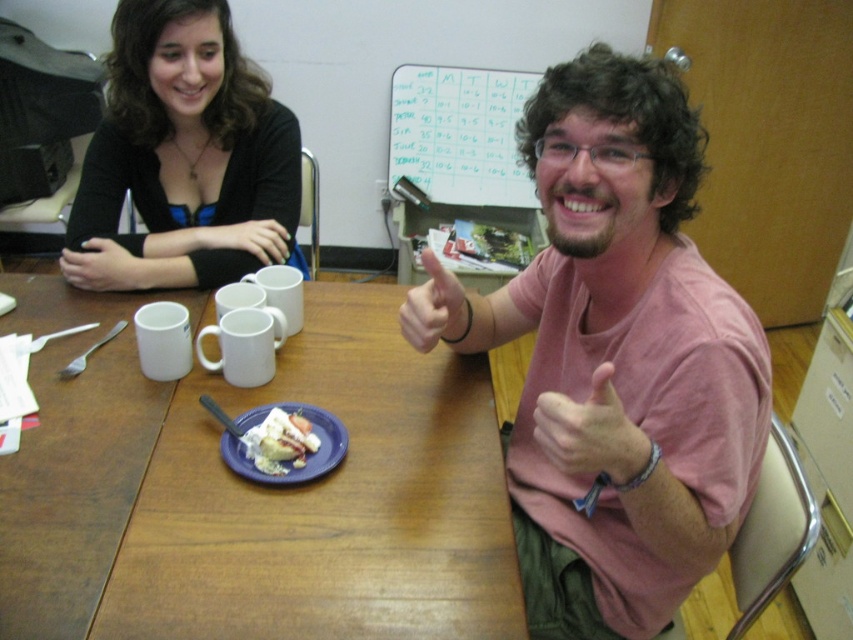
Question: In this image, where is black matte wristband at upper left located relative to matte black arm at upper left?

Choices:
 (A) above
 (B) below

Answer: (B)

Question: Is wooden table at center below black matte sweater at upper left?

Choices:
 (A) yes
 (B) no

Answer: (A)

Question: Is pink cotton shirt at center positioned behind matte black arm at upper left?

Choices:
 (A) yes
 (B) no

Answer: (B)

Question: Which of the following is the farthest from the observer?

Choices:
 (A) (165, 44)
 (B) (123, 275)

Answer: (B)

Question: Which object appears farthest from the camera in this image?

Choices:
 (A) wooden table at center
 (B) black matte sweater at upper left

Answer: (B)

Question: Among these objects, which one is nearest to the camera?

Choices:
 (A) pink cotton shirt at center
 (B) wooden table at center
 (C) matte black arm at upper left
 (D) white creamy cake at center

Answer: (A)